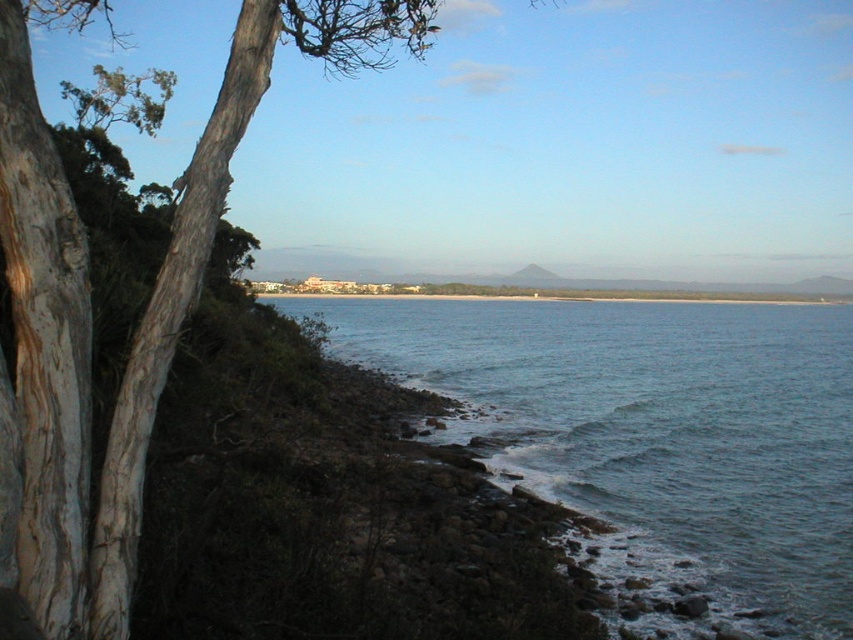
You are standing on the rugged shoreline and want to determine the relative heights of the blue water at lower right and the smooth bark tree at left. Based on the scene, which one is taller?

The smooth bark tree at left is taller than the blue water at lower right.

You are standing on the rugged shoreline looking towards the smooth bark tree at left. Which direction should you walk to reach the blue water at lower right without passing through the tree?

You should walk towards the lower right direction to reach the blue water at lower right without passing through the smooth bark tree at left, as the blue water at lower right is located below the tree.

You are standing on the rugged shoreline and want to compare the widths of the blue water at lower right and the smooth bark tree at left. Which one has a narrower width?

The blue water at lower right is thinner than the smooth bark tree at left, so the blue water at lower right has a narrower width.